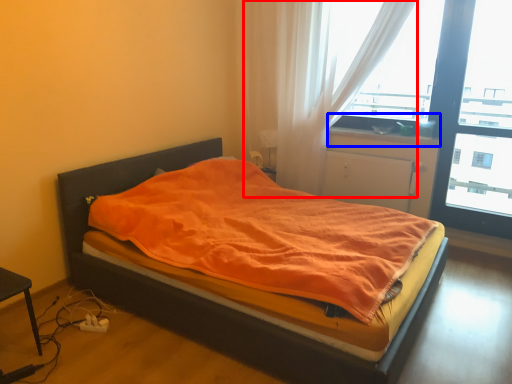
Question: Which point is further to the camera, curtain (highlighted by a red box) or window sill (highlighted by a blue box)?

Choices:
 (A) curtain
 (B) window sill

Answer: (B)